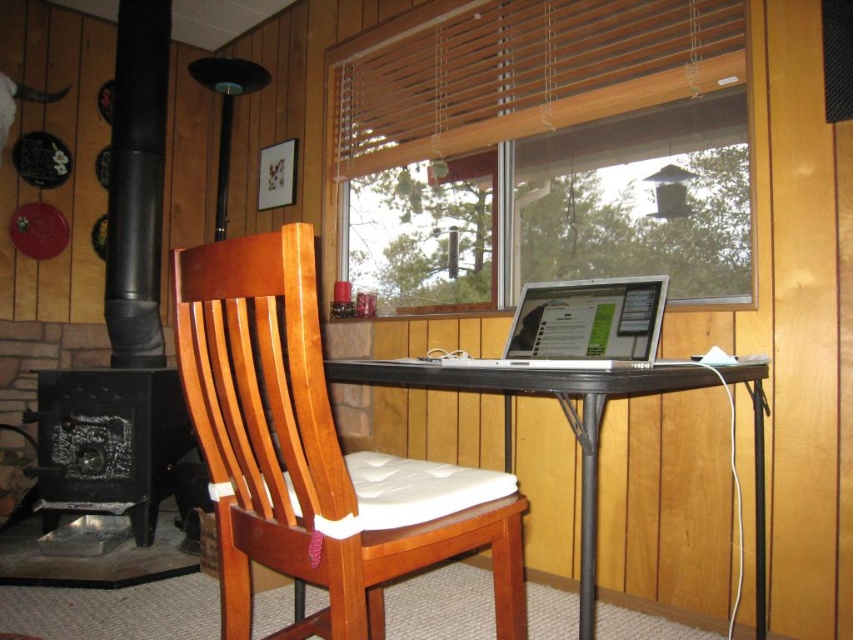
Consider the image. You are planning to place a large potted plant in the center of the room. Considering the space between the wooden blinds at upper center and the black metal table at center, will the plant fit comfortably without overcrowding the area?

The wooden blinds at upper center is larger in size than black metal table at center, so placing a large potted plant in the center may cause overcrowding due to the already significant size of the wooden blinds at upper center occupying the space.

You are trying to place a new decorative item on the floor between the black cast iron fireplace at lower left and the silver metallic laptop at center. If the decorative item is 1.2 meters wide, will it fit without overlapping either object?

The black cast iron fireplace at lower left might be wider than the silver metallic laptop at center. However, since the exact width difference isn t specified, it s uncertain whether the 1.2 meter decorative item will fit. You should measure the space first before placing it.

You are a delivery person who just arrived at this cabin. You need to place a large package that is 1 meter long on the floor between the black cast iron fireplace at lower left and the black metal table at center. Is there enough space for the package to fit horizontally between them?

The distance between the black cast iron fireplace at lower left and the black metal table at center is 97.90 centimeters. Since the package is 1 meter long, which is 100 centimeters, it will not fit as the space is slightly smaller than the package.